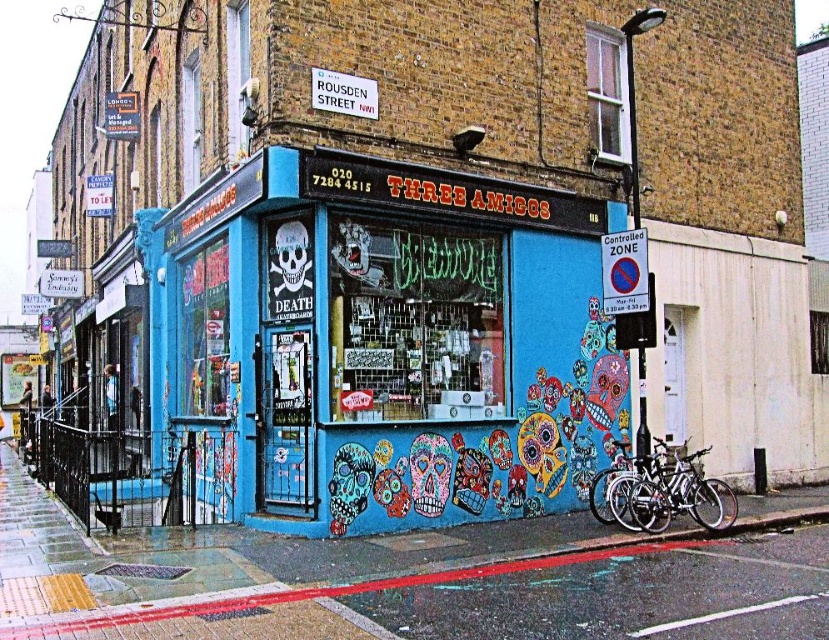
Does blue painted wall at center lie behind silver metallic bicycle at lower right?

No, blue painted wall at center is in front of silver metallic bicycle at lower right.

Between blue painted wall at center and silver metallic bicycle at lower right, which one is positioned lower?

silver metallic bicycle at lower right is below.

Which is in front, point (522, 228) or point (668, 493)?

Point (668, 493) is in front.

You are a GUI agent. You are given a task and a screenshot of the screen. Output one action in this format:
    pyautogui.click(x=<x>, y=<y>)
    Task: Click on the blue painted wall at center
    This screenshot has width=829, height=640.
    Given the screenshot: What is the action you would take?
    pyautogui.click(x=386, y=344)

Can you confirm if silver metallic bicycle at lower right is positioned to the right of white matte skull at center?

Correct, you'll find silver metallic bicycle at lower right to the right of white matte skull at center.

Which of these two, silver metallic bicycle at lower right or white matte skull at center, stands taller?

With more height is silver metallic bicycle at lower right.

Does point (657, 508) lie behind point (288, 278)?

That is True.

At what (x,y) coordinates should I click in order to perform the action: click on silver metallic bicycle at lower right. Please return your answer as a coordinate pair (x, y). The image size is (829, 640). Looking at the image, I should click on point(667,492).

Does blue painted wall at center appear under smooth concrete pavement at lower center?

No.

Does point (298, 186) come farther from viewer compared to point (117, 573)?

Yes, it is behind point (117, 573).

This screenshot has height=640, width=829. I want to click on blue painted wall at center, so click(x=386, y=344).